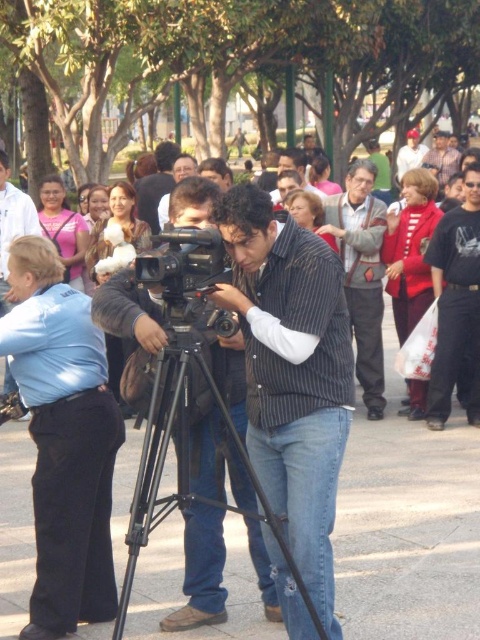
Question: Which of the following is the closest to the observer?

Choices:
 (A) matte black vest at center
 (B) dark brown leather jacket at center
 (C) striped sweater at center
 (D) jeans at center

Answer: (D)

Question: Does dark brown leather jacket at center appear under matte black vest at center?

Choices:
 (A) yes
 (B) no

Answer: (A)

Question: Estimate the real-world distances between objects in this image. Which object is farther from the dark blue jeans at center?

Choices:
 (A) matte black vest at center
 (B) dark brown leather jacket at center

Answer: (A)

Question: Which point is farther to the camera?

Choices:
 (A) (445, 300)
 (B) (156, 285)

Answer: (A)

Question: Does matte blue shirt at left have a smaller size compared to striped shirt at center?

Choices:
 (A) no
 (B) yes

Answer: (B)

Question: Can you confirm if dark blue jeans at center is positioned above matte black vest at center?

Choices:
 (A) yes
 (B) no

Answer: (B)